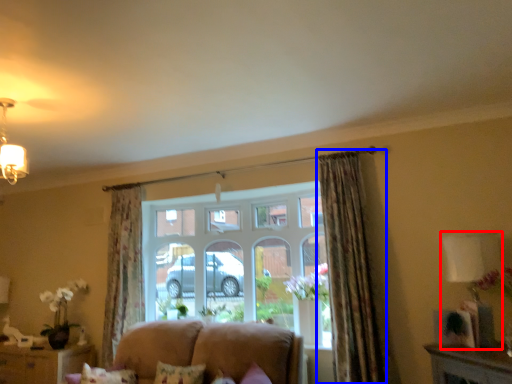
Question: Which object appears closest to the camera in this image, lamp (highlighted by a red box) or curtain (highlighted by a blue box)?

Choices:
 (A) lamp
 (B) curtain

Answer: (A)